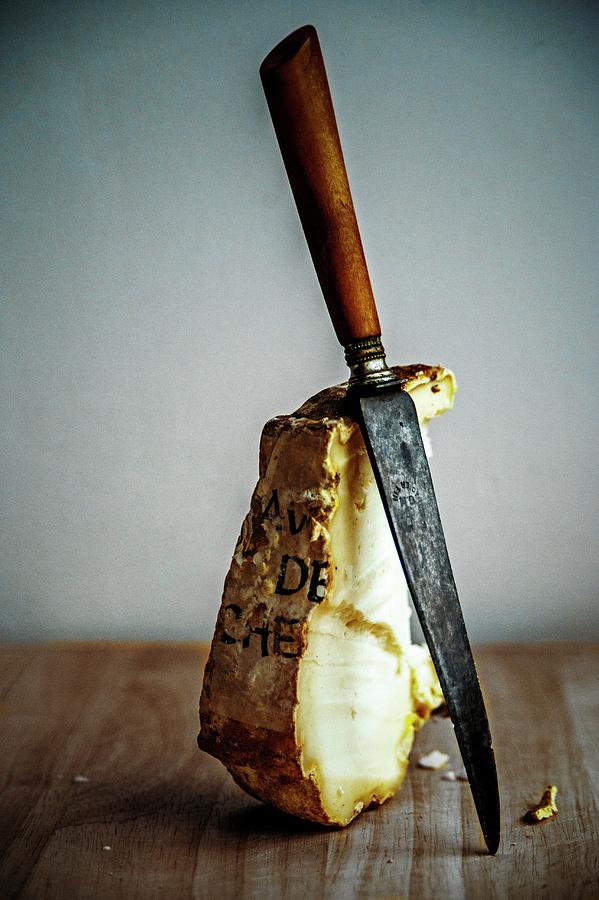
You are a GUI agent. You are given a task and a screenshot of the screen. Output one action in this format:
    pyautogui.click(x=<x>, y=<y>)
    Task: Click on the wooden handle
    The height and width of the screenshot is (900, 599).
    Given the screenshot: What is the action you would take?
    pyautogui.click(x=338, y=240)